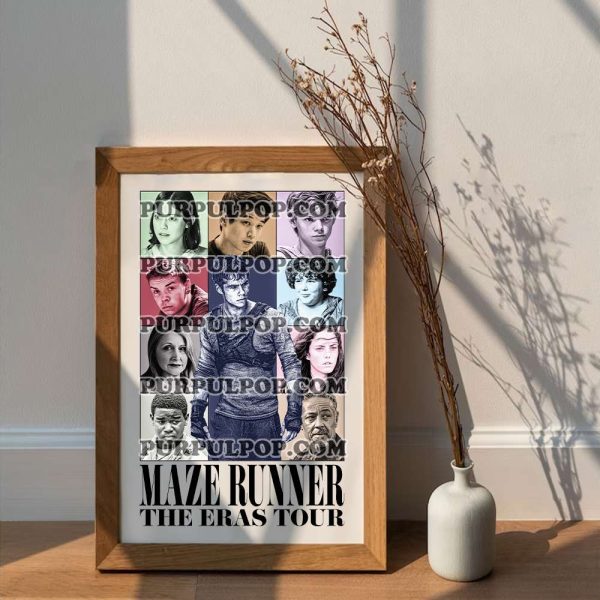
In order to click on wall in this screenshot , I will do `click(490, 64)`.